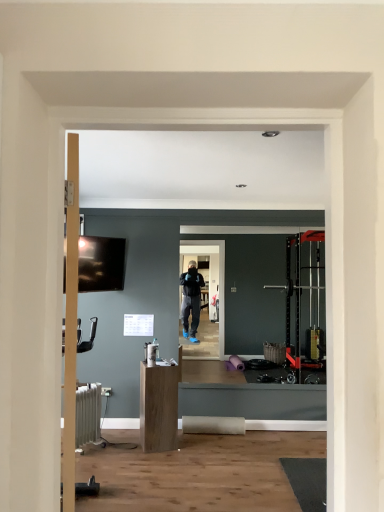
Question: Considering the relative sizes of light brown wood cabinet at center and white metallic radiator at lower left in the image provided, is light brown wood cabinet at center thinner than white metallic radiator at lower left?

Choices:
 (A) yes
 (B) no

Answer: (B)

Question: Is light brown wood cabinet at center oriented towards white metallic radiator at lower left?

Choices:
 (A) no
 (B) yes

Answer: (A)

Question: Considering the relative sizes of light brown wood cabinet at center and white metallic radiator at lower left in the image provided, is light brown wood cabinet at center bigger than white metallic radiator at lower left?

Choices:
 (A) no
 (B) yes

Answer: (B)

Question: Considering the relative positions of light brown wood cabinet at center and white metallic radiator at lower left in the image provided, is light brown wood cabinet at center in front of white metallic radiator at lower left?

Choices:
 (A) yes
 (B) no

Answer: (B)

Question: Would you say white metallic radiator at lower left is part of light brown wood cabinet at center's contents?

Choices:
 (A) no
 (B) yes

Answer: (A)

Question: Is light brown wood cabinet at center placed right next to white metallic radiator at lower left?

Choices:
 (A) yes
 (B) no

Answer: (B)

Question: From a real-world perspective, does light brown wood cabinet at center sit lower than matte black tv at upper left?

Choices:
 (A) yes
 (B) no

Answer: (A)

Question: Does light brown wood cabinet at center appear on the left side of matte black tv at upper left?

Choices:
 (A) no
 (B) yes

Answer: (A)

Question: From the image's perspective, is light brown wood cabinet at center located above matte black tv at upper left?

Choices:
 (A) no
 (B) yes

Answer: (A)

Question: Can you confirm if light brown wood cabinet at center is positioned to the right of matte black tv at upper left?

Choices:
 (A) yes
 (B) no

Answer: (A)

Question: Does light brown wood cabinet at center have a greater width compared to matte black tv at upper left?

Choices:
 (A) yes
 (B) no

Answer: (A)

Question: Is light brown wood cabinet at center turned away from matte black tv at upper left?

Choices:
 (A) no
 (B) yes

Answer: (A)

Question: From the image's perspective, is matte black tv at upper left located beneath white metallic radiator at lower left?

Choices:
 (A) yes
 (B) no

Answer: (B)